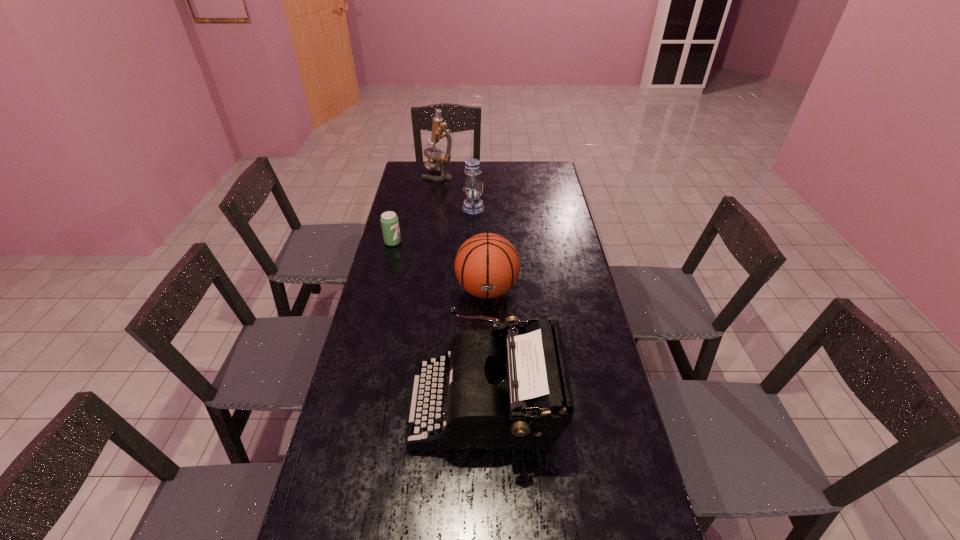
Locate an element on the screen. Image resolution: width=960 pixels, height=540 pixels. free location located on the typing side of the typewriter is located at coordinates (343, 402).

This screenshot has width=960, height=540. Identify the location of free space located 0.110m on the typing side of the typewriter. (372, 402).

At what (x,y) coordinates should I click in order to perform the action: click on free region located 0.130m on the typing side of the typewriter. Please return your answer as a coordinate pair (x, y). This screenshot has height=540, width=960. Looking at the image, I should click on (365, 402).

This screenshot has width=960, height=540. What are the coordinates of `vacant space situated 0.220m on the back of the fifth tallest object` in the screenshot? It's located at (401, 207).

The image size is (960, 540). What are the coordinates of `object present at the far edge` in the screenshot? It's located at (439, 130).

In order to click on microscope positioned at the left edge in this screenshot , I will do `click(439, 130)`.

Image resolution: width=960 pixels, height=540 pixels. In order to click on soda located in the left edge section of the desktop in this screenshot , I will do `click(389, 220)`.

You are a GUI agent. You are given a task and a screenshot of the screen. Output one action in this format:
    pyautogui.click(x=<x>, y=<y>)
    Task: Click on the object that is at the far left corner
    Image resolution: width=960 pixels, height=540 pixels.
    Given the screenshot: What is the action you would take?
    pyautogui.click(x=439, y=130)

Where is `vacant space at the far edge`? vacant space at the far edge is located at coordinates (483, 168).

Locate an element on the screen. This screenshot has width=960, height=540. free spot at the left edge of the desktop is located at coordinates (392, 402).